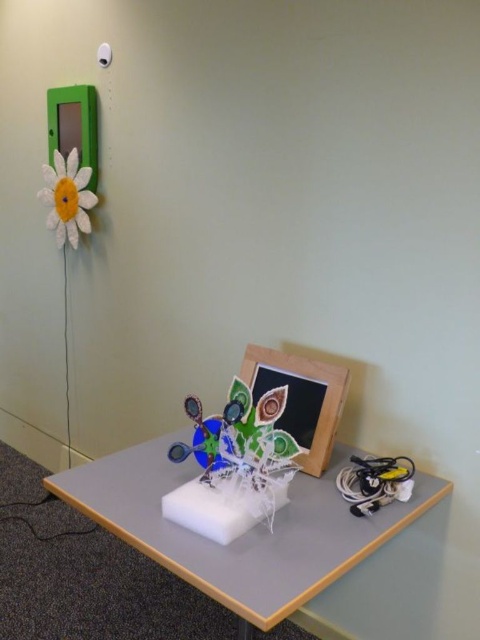
Between white foam block at center and white fabric flower at upper left, which one appears on the right side from the viewer's perspective?

Positioned to the right is white foam block at center.

Describe the element at coordinates (242, 536) in the screenshot. I see `white foam block at center` at that location.

Where is `white foam block at center`? This screenshot has width=480, height=640. white foam block at center is located at coordinates (242, 536).

Who is positioned more to the left, white foam block at center or wooden picture frame at center?

Positioned to the left is white foam block at center.

Describe the element at coordinates (242, 536) in the screenshot. I see `white foam block at center` at that location.

I want to click on white foam block at center, so click(242, 536).

Measure the distance between point (335, 396) and camera.

Point (335, 396) and camera are 1.59 meters apart from each other.

Does wooden picture frame at center appear under white fabric flower at upper left?

Indeed, wooden picture frame at center is positioned under white fabric flower at upper left.

Is point (303, 426) farther from viewer compared to point (56, 188)?

No.

At what (x,y) coordinates should I click in order to perform the action: click on wooden picture frame at center. Please return your answer as a coordinate pair (x, y). This screenshot has width=480, height=640. Looking at the image, I should click on (300, 397).